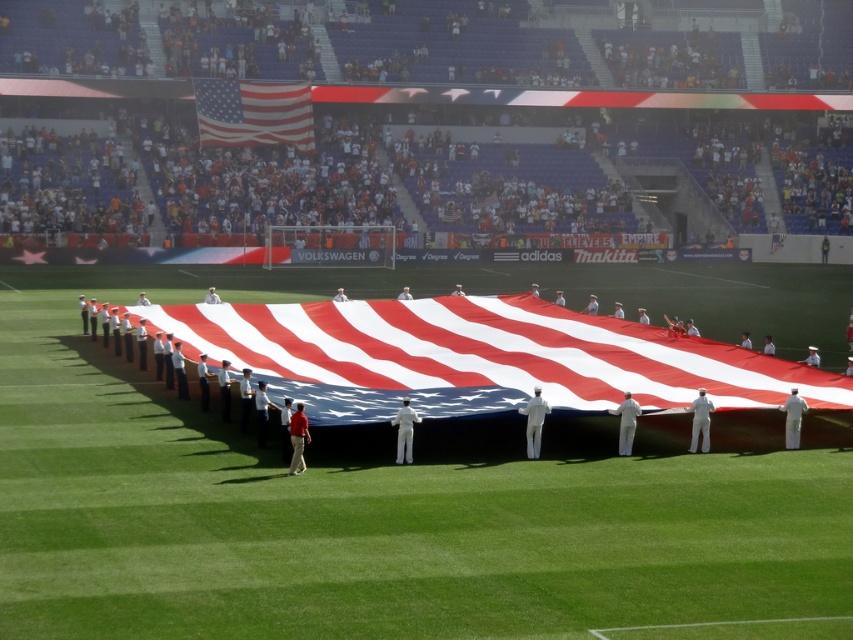
Question: Among these points, which one is farthest from the camera?

Choices:
 (A) (585, 321)
 (B) (851, 497)
 (C) (311, 124)

Answer: (C)

Question: Does american flag at center have a smaller size compared to matte fabric flag at upper center?

Choices:
 (A) yes
 (B) no

Answer: (B)

Question: Which point appears farthest from the camera in this image?

Choices:
 (A) (712, 396)
 (B) (53, 392)

Answer: (B)

Question: Considering the relative positions of red-white striped fabric at center and matte fabric flag at upper center in the image provided, where is red-white striped fabric at center located with respect to matte fabric flag at upper center?

Choices:
 (A) above
 (B) below

Answer: (B)

Question: Among these objects, which one is farthest from the camera?

Choices:
 (A) red-white striped fabric at center
 (B) american flag at center
 (C) matte fabric flag at upper center

Answer: (C)

Question: Can you confirm if red-white striped fabric at center is positioned above matte fabric flag at upper center?

Choices:
 (A) yes
 (B) no

Answer: (B)